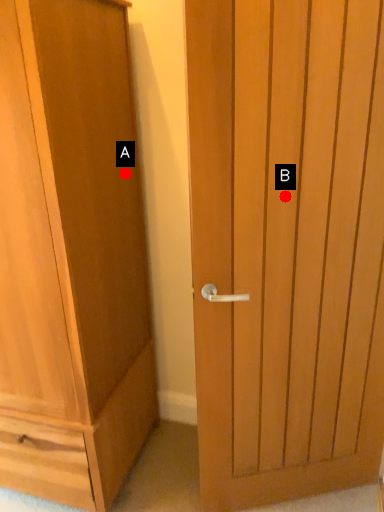
Question: Two points are circled on the image, labeled by A and B beside each circle. Among these points, which one is nearest to the camera?

Choices:
 (A) A is closer
 (B) B is closer

Answer: (B)